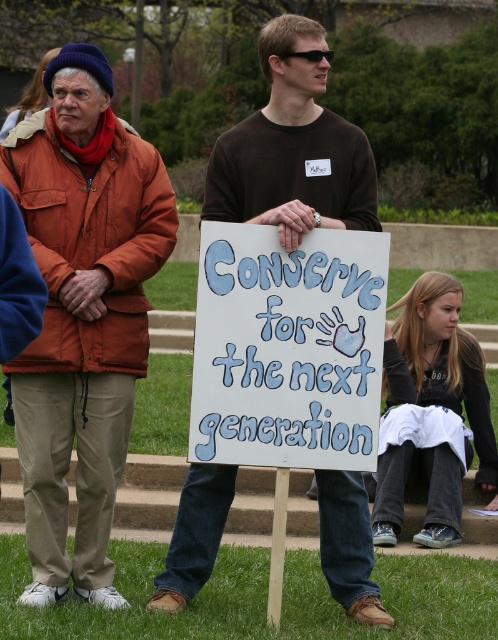
Question: Which point appears farthest from the camera in this image?

Choices:
 (A) (246, 352)
 (B) (139, 196)
 (C) (386, 433)

Answer: (C)

Question: Which point is closer to the camera?

Choices:
 (A) (328, 516)
 (B) (110, 378)
 (C) (224, 412)

Answer: (C)

Question: Which object is the closest to the white painted wood sign at center?

Choices:
 (A) orange fabric jacket at left
 (B) black cotton shirt at lower right

Answer: (A)

Question: Where is orange fabric jacket at left located in relation to white painted wood sign at center in the image?

Choices:
 (A) right
 (B) left

Answer: (B)

Question: Can you confirm if white painted wood sign at center is wider than black cotton shirt at lower right?

Choices:
 (A) yes
 (B) no

Answer: (A)

Question: Considering the relative positions of white painted wood sign at center and brown cotton shirt at center in the image provided, where is white painted wood sign at center located with respect to brown cotton shirt at center?

Choices:
 (A) left
 (B) right

Answer: (B)